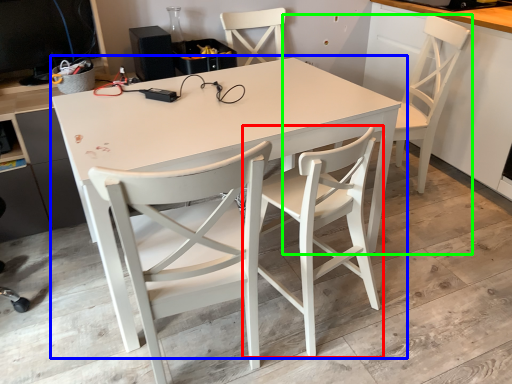
Question: Which object is positioned farthest from chair (highlighted by a red box)? Select from table (highlighted by a blue box) and chair (highlighted by a green box).

Choices:
 (A) table
 (B) chair

Answer: (B)